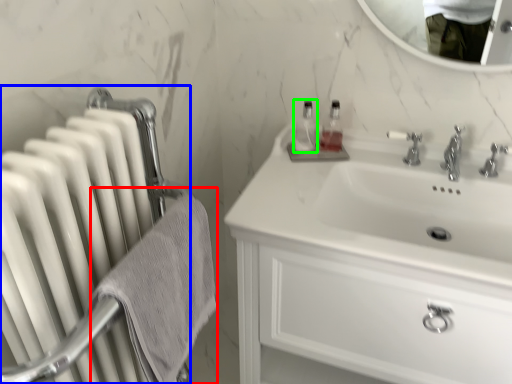
Question: Estimate the real-world distances between objects in this image. Which object is closer to bath towel (highlighted by a red box), radiator (highlighted by a blue box) or bottle (highlighted by a green box)?

Choices:
 (A) radiator
 (B) bottle

Answer: (A)